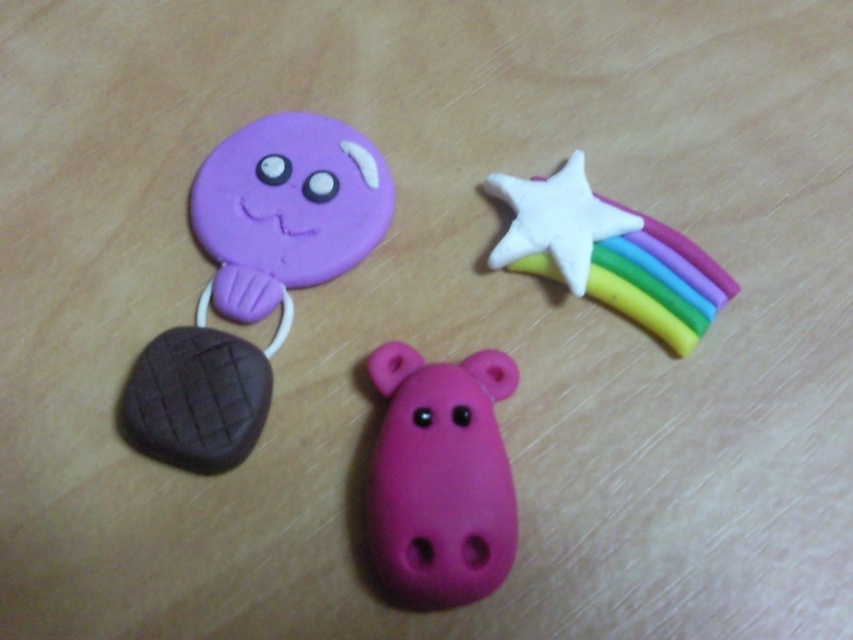
You are holding a camera and want to take a photo of the pastel rainbow star at upper right. If the camera requires a minimum distance of 1.5 meters to focus properly, will you be able to focus on the star?

The pastel rainbow star at upper right and camera are 1.37 meters apart from each other, which is less than the required 1.5 meters. Therefore, the camera will not be able to focus properly on the star.

What is the relationship between the point at coordinates (286, 209) and the matte purple cookie at upper left?

The point at coordinates (286, 209) is located on the matte purple cookie at upper left.